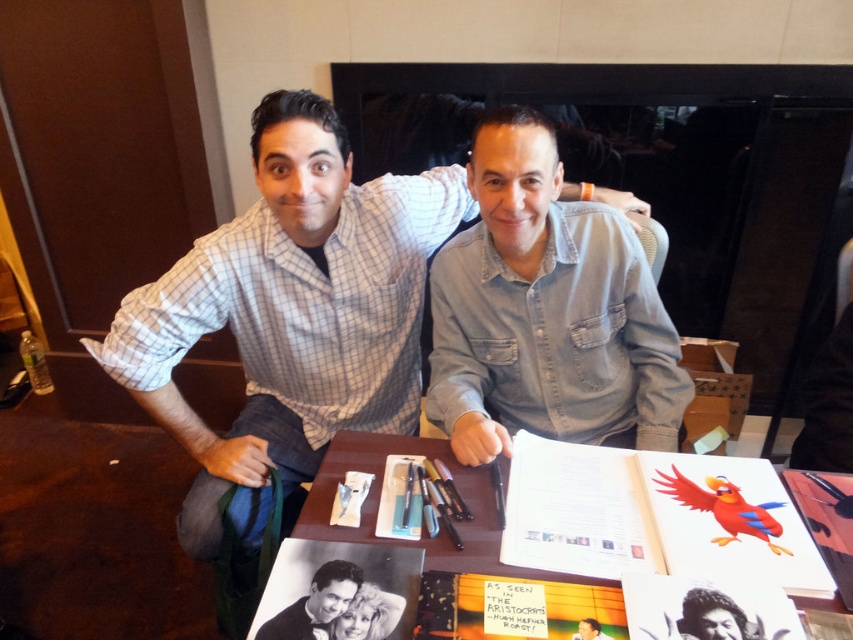
You are a photographer trying to capture a closeup of the denim shirt at center. The camera you are using has a focal length of 50mm and you are currently positioned 2 meters away from the subject. To ensure the shirt fills the frame, you need to move closer. What is the minimum distance you should be from the subject to achieve this?

The denim shirt at center is located at point coordinates of (546, 310). To calculate the required distance, use the formula distance equals focal length multiplied by subject height divided by desired image height. However, without knowing the subject height or desired image height, an exact distance cannot be determined. Please provide additional measurements for an accurate calculation.

In the scene shown: You are standing in front of the table where the two individuals are seated. If you were to place a small vase exactly at the point with coordinates (422, 529), would it be on the wooden table at center?

Yes, the point at (422, 529) corresponds to the location of the wooden table at center, so placing the vase there would place it on the table.